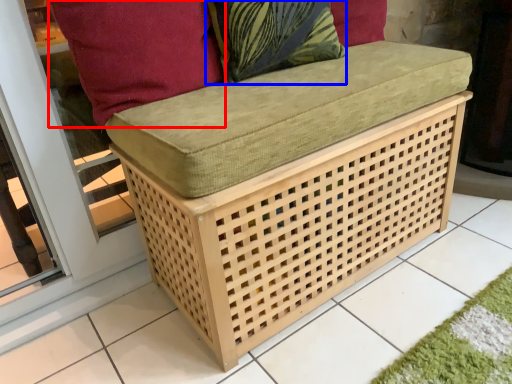
Question: Which object is closer to the camera taking this photo, pillow (highlighted by a red box) or throw pillow (highlighted by a blue box)?

Choices:
 (A) pillow
 (B) throw pillow

Answer: (A)